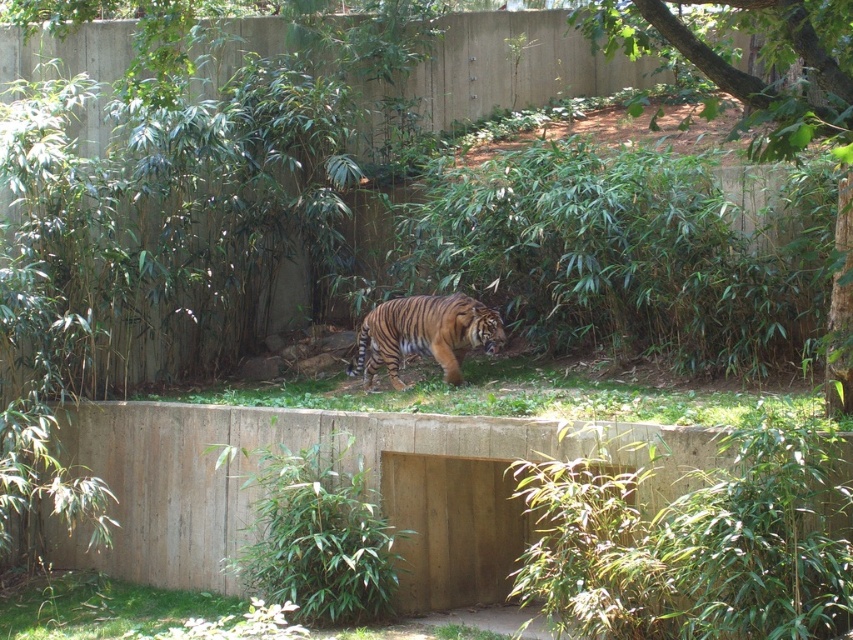
Which is behind, point (491, 472) or point (426, 323)?

The point (426, 323) is behind.

Is the position of concrete at center less distant than that of orange striped tiger at center?

That is True.

Is point (476, 490) closer to viewer compared to point (489, 310)?

Yes, point (476, 490) is closer to viewer.

Find the location of a particular element. Image resolution: width=853 pixels, height=640 pixels. concrete at center is located at coordinates (346, 470).